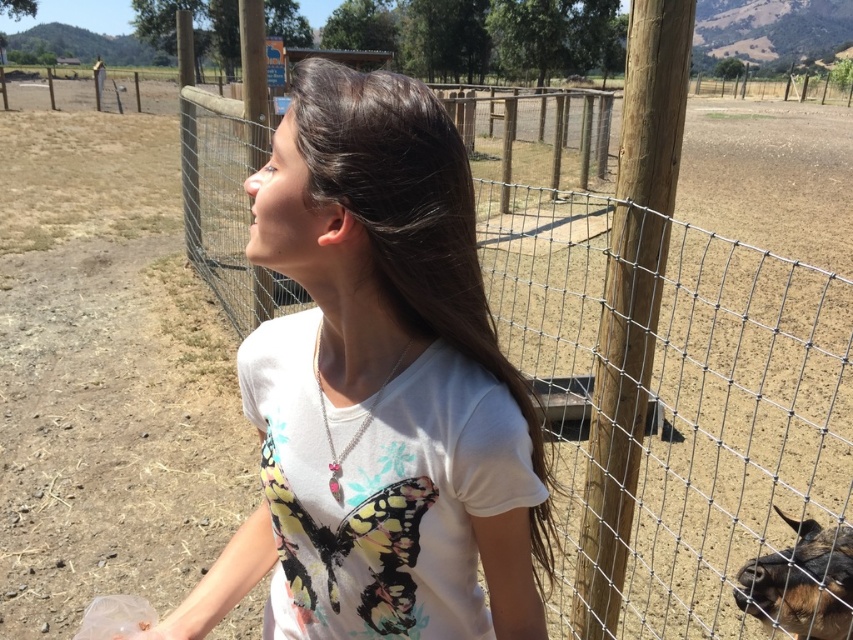
You are standing in a farm enclosure and want to reach a specific point marked at coordinates point (492, 369). If your arm length is 28 inches, can you reach that point without moving closer?

The distance of point (492, 369) from viewer is 33.32 inches, so you cannot reach it with an arm length of 28 inches since it is farther away.

You are a photographer trying to capture a clear photo of the white matte shirt at center and the brown furry goat at lower right. Which object should you focus on first if you want to ensure both are in focus without adjusting the camera settings?

You should focus on the white matte shirt at center first because it is taller than the brown furry goat at lower right, so focusing on the taller object will help keep both in focus.

You are a photographer trying to capture a clear photo of the white matte shirt at center and the brown furry goat at lower right. Which object should you focus on first if you want to ensure both are in focus, considering their sizes?

The white matte shirt at center is larger in size than the brown furry goat at lower right, so you should focus on the white matte shirt at center first to ensure both are in focus.